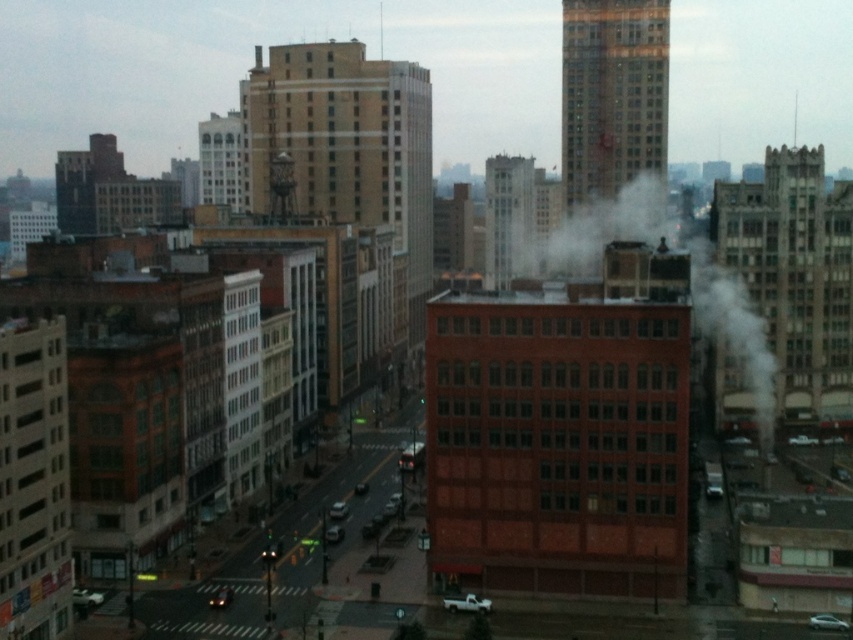
You are standing on the sidewalk in the middle of the street. You see the beige brick building at center and the brick building at left. Which building is closer to your right side?

The beige brick building at center is closer to your right side because it is positioned to the right of the brick building at left.

You are a city planner analyzing traffic patterns in this area. You notice a white smoke at center marked by point (689, 284). What might this indicate about the traffic situation at that location?

The white smoke at center marked by point (689, 284) likely indicates heavy traffic congestion or idling vehicles emitting exhaust fumes, which is common in urban areas during peak hours.

You are a delivery driver trying to navigate through the city. You see the beige brick building at center and the brick building at left. Which one is closer to you based on their positions in the scene?

The beige brick building at center is closer to you because the brick building at left is behind it, indicating it is farther away.